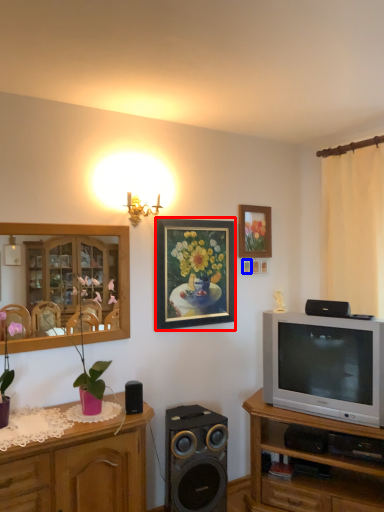
Question: Which point is further to the camera, picture frame (highlighted by a red box) or picture frame (highlighted by a blue box)?

Choices:
 (A) picture frame
 (B) picture frame

Answer: (B)